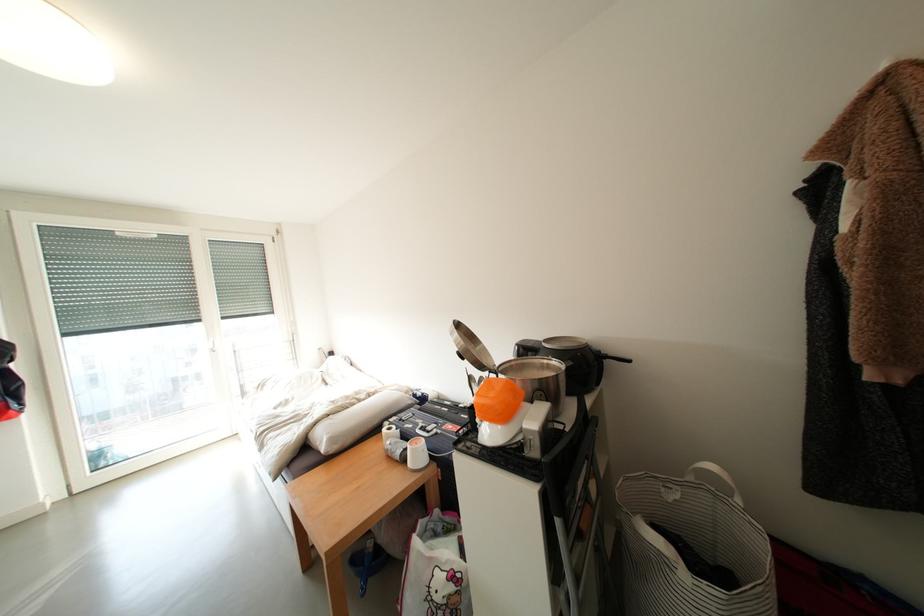
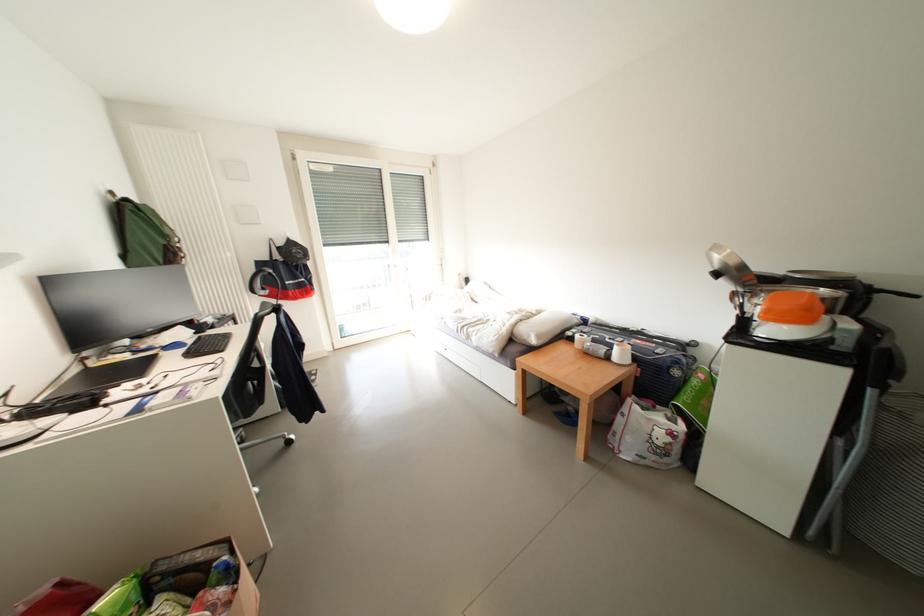
In the second image, find the point that corresponds to pixel 426 434 in the first image.

(614, 342)